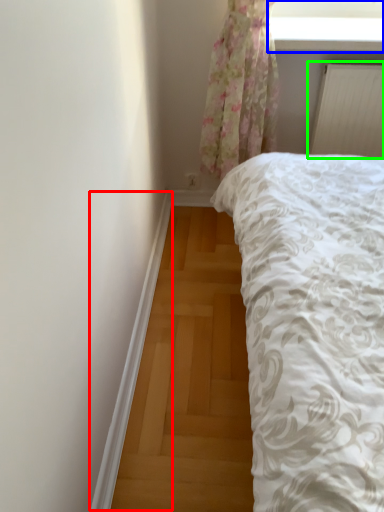
Question: Which object is the closest to the trim (highlighted by a red box)? Choose among these: window screen (highlighted by a blue box) or radiator (highlighted by a green box).

Choices:
 (A) window screen
 (B) radiator

Answer: (B)